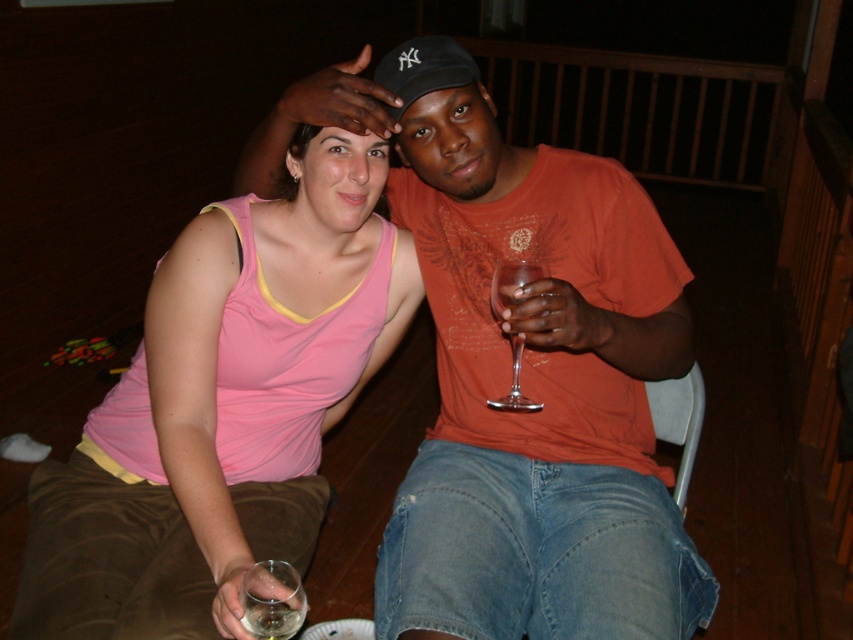
You are a photographer trying to capture a closeup shot of the pink fabric tank top at center without the clear glass wine glass at lower left blocking the view. Based on their sizes, is this possible?

The pink fabric tank top at center might be wider than clear glass wine glass at lower left, so it is possible that the wine glass may not fully block the tank top if positioned correctly.